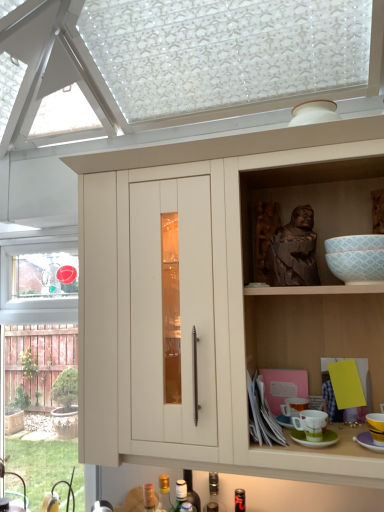
Question: From a real-world perspective, does translucent glass bottle at lower center, acting as the first bottle starting from the left, sit lower than brown wooden statue at upper right?

Choices:
 (A) no
 (B) yes

Answer: (B)

Question: Does translucent glass bottle at lower center, acting as the first bottle starting from the left, lie in front of brown wooden statue at upper right?

Choices:
 (A) no
 (B) yes

Answer: (A)

Question: Can you confirm if translucent glass bottle at lower center, acting as the first bottle starting from the left, is shorter than brown wooden statue at upper right?

Choices:
 (A) no
 (B) yes

Answer: (A)

Question: Is brown wooden statue at upper right located within translucent glass bottle at lower center, the 4th bottle in the right-to-left sequence?

Choices:
 (A) yes
 (B) no

Answer: (B)

Question: Is translucent glass bottle at lower center, the 4th bottle in the right-to-left sequence, to the right of brown wooden statue at upper right from the viewer's perspective?

Choices:
 (A) yes
 (B) no

Answer: (B)

Question: Is matte wood cabinet at center taller or shorter than brown wooden statue at upper right?

Choices:
 (A) tall
 (B) short

Answer: (A)

Question: Based on their sizes in the image, would you say matte wood cabinet at center is bigger or smaller than brown wooden statue at upper right?

Choices:
 (A) small
 (B) big

Answer: (B)

Question: Considering the positions of point (124, 224) and point (261, 236), is point (124, 224) closer or farther from the camera than point (261, 236)?

Choices:
 (A) farther
 (B) closer

Answer: (B)

Question: Is matte wood cabinet at center spatially inside brown wooden statue at upper right, or outside of it?

Choices:
 (A) outside
 (B) inside

Answer: (A)

Question: Based on their sizes in the image, would you say matte ceramic mug at lower right, marked as the first tableware in a left-to-right arrangement, is bigger or smaller than yellow matte cup at lower right, positioned as the first tableware in right-to-left order?

Choices:
 (A) big
 (B) small

Answer: (B)

Question: From a real-world perspective, relative to yellow matte cup at lower right, the 2th tableware when ordered from left to right, is matte ceramic mug at lower right, the 2th tableware viewed from the right, vertically above or below?

Choices:
 (A) below
 (B) above

Answer: (A)

Question: From the image's perspective, is matte ceramic mug at lower right, marked as the first tableware in a left-to-right arrangement, located above or below yellow matte cup at lower right, positioned as the first tableware in right-to-left order?

Choices:
 (A) above
 (B) below

Answer: (B)

Question: Considering their positions, is matte ceramic mug at lower right, the 2th tableware viewed from the right, located in front of or behind yellow matte cup at lower right, positioned as the first tableware in right-to-left order?

Choices:
 (A) front
 (B) behind

Answer: (B)

Question: From a real-world perspective, is matte wood cabinet at center above or below translucent glass bottle at lower center, acting as the first bottle starting from the left?

Choices:
 (A) above
 (B) below

Answer: (A)

Question: Considering the positions of matte wood cabinet at center and translucent glass bottle at lower center, the 4th bottle in the right-to-left sequence, in the image, is matte wood cabinet at center taller or shorter than translucent glass bottle at lower center, the 4th bottle in the right-to-left sequence,?

Choices:
 (A) short
 (B) tall

Answer: (B)